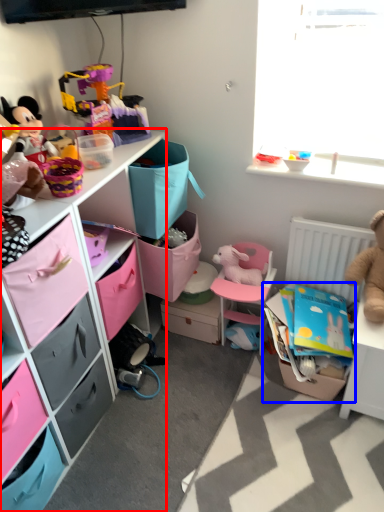
Question: Which object is closer to the camera taking this photo, cabinetry (highlighted by a red box) or storage box (highlighted by a blue box)?

Choices:
 (A) cabinetry
 (B) storage box

Answer: (A)